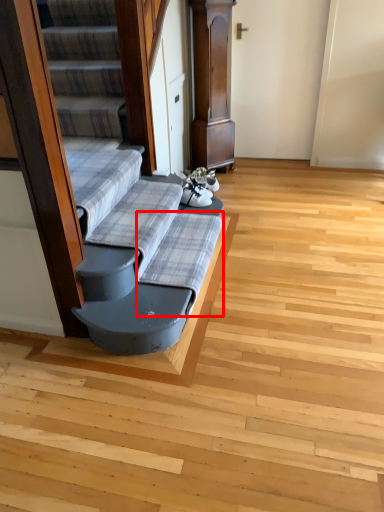
Question: From the image's perspective, considering the relative positions of sheet (annotated by the red box) and sheet in the image provided, where is sheet (annotated by the red box) located with respect to the staircase?

Choices:
 (A) above
 (B) below

Answer: (B)